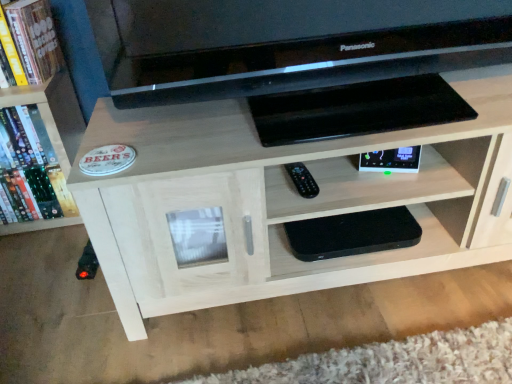
Question: Is black plastic remote at center to the left of wooden bookshelf at left from the viewer's perspective?

Choices:
 (A) yes
 (B) no

Answer: (B)

Question: Can you confirm if black plastic remote at center is thinner than wooden bookshelf at left?

Choices:
 (A) no
 (B) yes

Answer: (B)

Question: From the image's perspective, is black plastic remote at center under wooden bookshelf at left?

Choices:
 (A) no
 (B) yes

Answer: (B)

Question: Is black plastic remote at center not close to wooden bookshelf at left?

Choices:
 (A) no
 (B) yes

Answer: (A)

Question: Considering the relative positions of black plastic remote at center and wooden bookshelf at left in the image provided, is black plastic remote at center to the right of wooden bookshelf at left from the viewer's perspective?

Choices:
 (A) no
 (B) yes

Answer: (B)

Question: From the image's perspective, is black plastic remote at center above or below black matte speaker at lower center, the 2th shelf in the top-to-bottom sequence?

Choices:
 (A) below
 (B) above

Answer: (B)

Question: In the image, is black plastic remote at center on the left side or the right side of black matte speaker at lower center, the 2th shelf in the top-to-bottom sequence?

Choices:
 (A) left
 (B) right

Answer: (A)

Question: In terms of height, does black plastic remote at center look taller or shorter compared to black matte speaker at lower center, which is the first shelf from bottom to top?

Choices:
 (A) tall
 (B) short

Answer: (B)

Question: From a real-world perspective, is black plastic remote at center physically located above or below black matte speaker at lower center, the 2th shelf in the top-to-bottom sequence?

Choices:
 (A) below
 (B) above

Answer: (B)

Question: In terms of size, does light wood shelf at center, the 1th shelf viewed from the top, appear bigger or smaller than black matte speaker at lower center, which is the first shelf from bottom to top?

Choices:
 (A) big
 (B) small

Answer: (A)

Question: Does point click(x=294, y=150) appear closer or farther from the camera than point click(x=274, y=278)?

Choices:
 (A) farther
 (B) closer

Answer: (B)

Question: Considering their positions, is light wood shelf at center, the 1th shelf viewed from the top, located in front of or behind black matte speaker at lower center, the 2th shelf in the top-to-bottom sequence?

Choices:
 (A) behind
 (B) front

Answer: (B)

Question: Is light wood shelf at center, acting as the 2th shelf starting from the bottom, taller or shorter than black matte speaker at lower center, which is the first shelf from bottom to top?

Choices:
 (A) tall
 (B) short

Answer: (A)

Question: In the image, is hardcover book at upper left positioned in front of or behind black plastic remote at center?

Choices:
 (A) behind
 (B) front

Answer: (A)

Question: Is hardcover book at upper left to the left or to the right of black plastic remote at center in the image?

Choices:
 (A) left
 (B) right

Answer: (A)